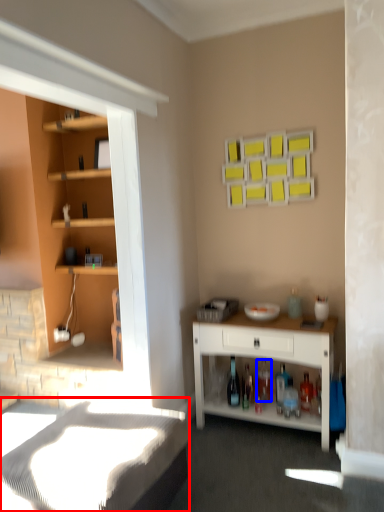
Question: Among these objects, which one is farthest to the camera, bed frame (highlighted by a red box) or bottle (highlighted by a blue box)?

Choices:
 (A) bed frame
 (B) bottle

Answer: (B)